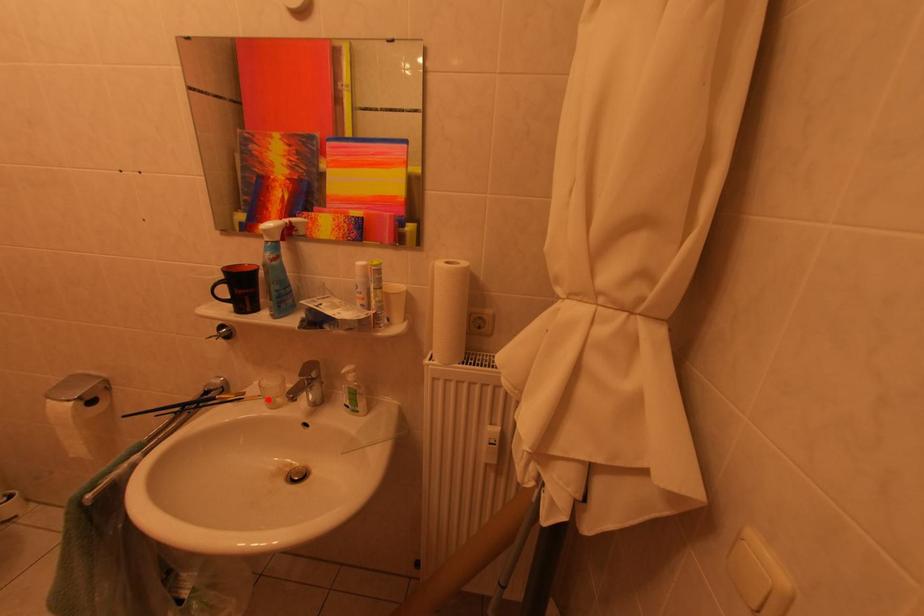
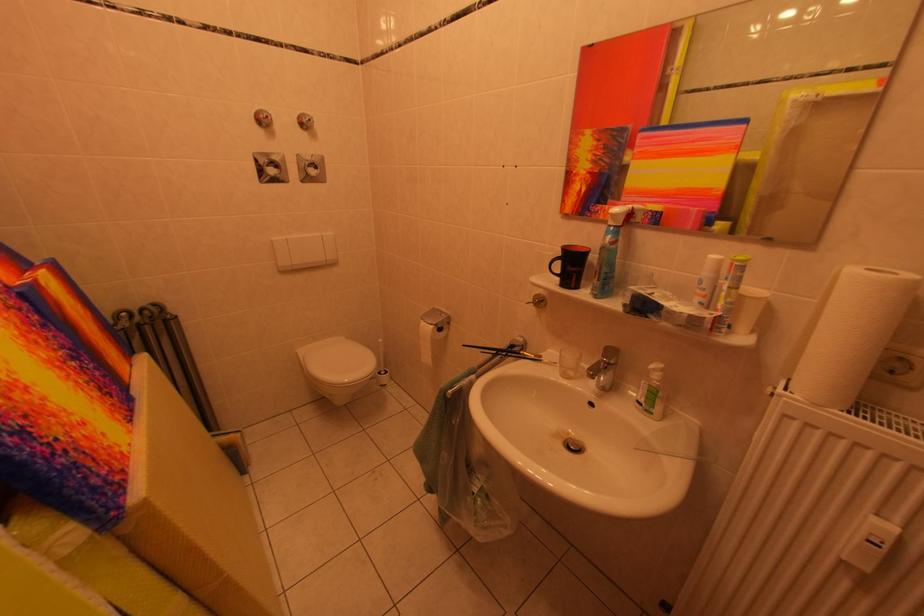
Question: I am providing you with two images of the same scene from different viewpoints. In image1, a red point is highlighted. Considering the same 3D point in image2, which of the following is correct?

Choices:
 (A) It is closer
 (B) It is farther

Answer: (A)